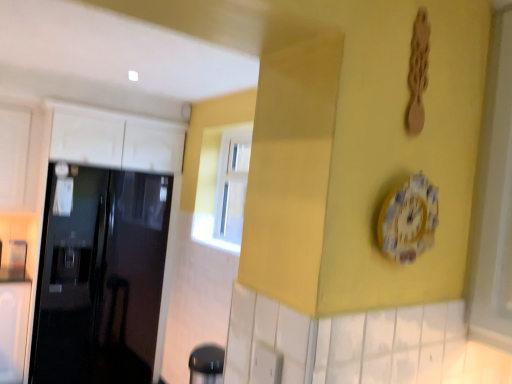
Question: From a real-world perspective, is glossy black door at left physically located above or below porcelain floral clock at center?

Choices:
 (A) above
 (B) below

Answer: (B)

Question: Which is correct: glossy black door at left is inside porcelain floral clock at center, or outside of it?

Choices:
 (A) outside
 (B) inside

Answer: (A)

Question: Considering the relative positions of glossy black door at left and porcelain floral clock at center in the image provided, is glossy black door at left to the left or to the right of porcelain floral clock at center?

Choices:
 (A) left
 (B) right

Answer: (A)

Question: Is porcelain floral clock at center taller or shorter than glossy black door at left?

Choices:
 (A) short
 (B) tall

Answer: (A)

Question: Looking at their shapes, would you say porcelain floral clock at center is wider or thinner than glossy black door at left?

Choices:
 (A) wide
 (B) thin

Answer: (B)

Question: From the image's perspective, is porcelain floral clock at center positioned above or below glossy black door at left?

Choices:
 (A) above
 (B) below

Answer: (A)

Question: From a real-world perspective, is porcelain floral clock at center physically located above or below glossy black door at left?

Choices:
 (A) above
 (B) below

Answer: (A)